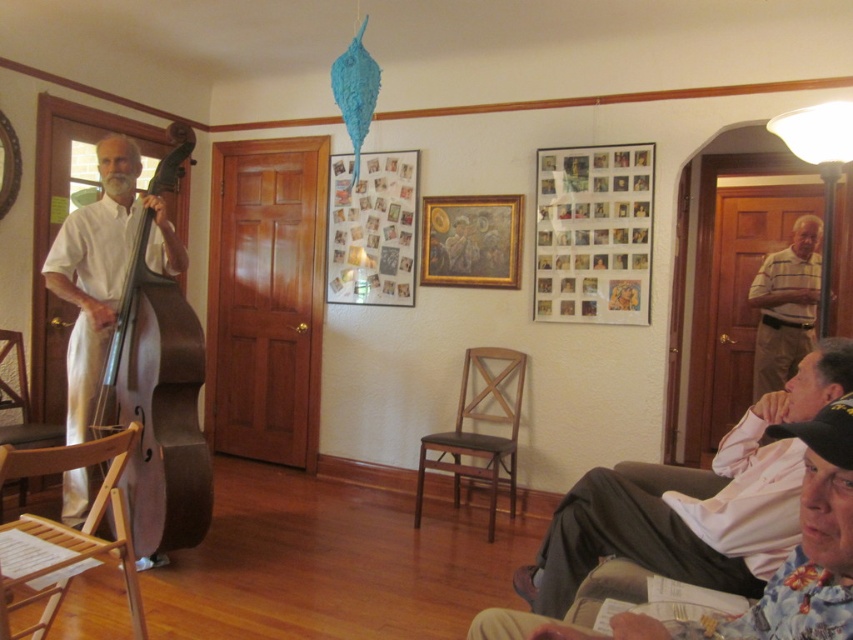
Question: Which of these objects is positioned farthest from the wooden folding chair at lower left?

Choices:
 (A) brown wood chair at center
 (B) metallic silver photo frame at upper right

Answer: (B)

Question: Is matte brown cello at left to the left of wooden armchair at left from the viewer's perspective?

Choices:
 (A) no
 (B) yes

Answer: (A)

Question: Can you confirm if pink fabric shirt at lower right is wider than matte brown cello at left?

Choices:
 (A) no
 (B) yes

Answer: (B)

Question: From the image, what is the correct spatial relationship of striped cotton shirt at right in relation to wooden armchair at left?

Choices:
 (A) left
 (B) right

Answer: (B)

Question: Estimate the real-world distances between objects in this image. Which object is closer to the wooden framed painting at center?

Choices:
 (A) striped cotton shirt at right
 (B) pink fabric shirt at lower right
 (C) brown wood chair at center

Answer: (C)

Question: Which point is farther from the camera taking this photo?

Choices:
 (A) (78, 456)
 (B) (488, 524)
 (C) (24, 372)
 (D) (793, 314)

Answer: (D)